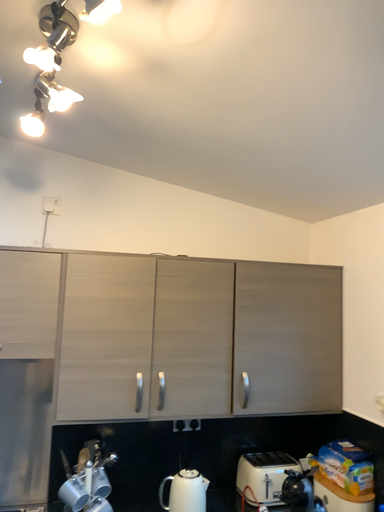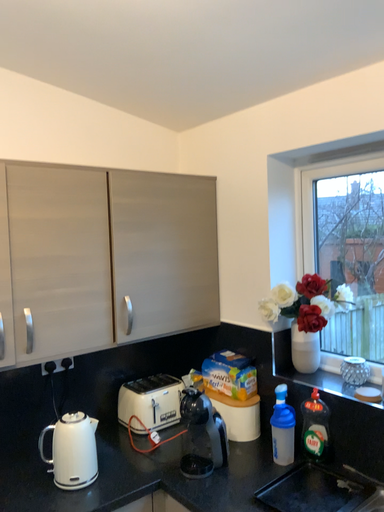
Question: How did the camera likely rotate when shooting the video?

Choices:
 (A) rotated right
 (B) rotated left

Answer: (A)